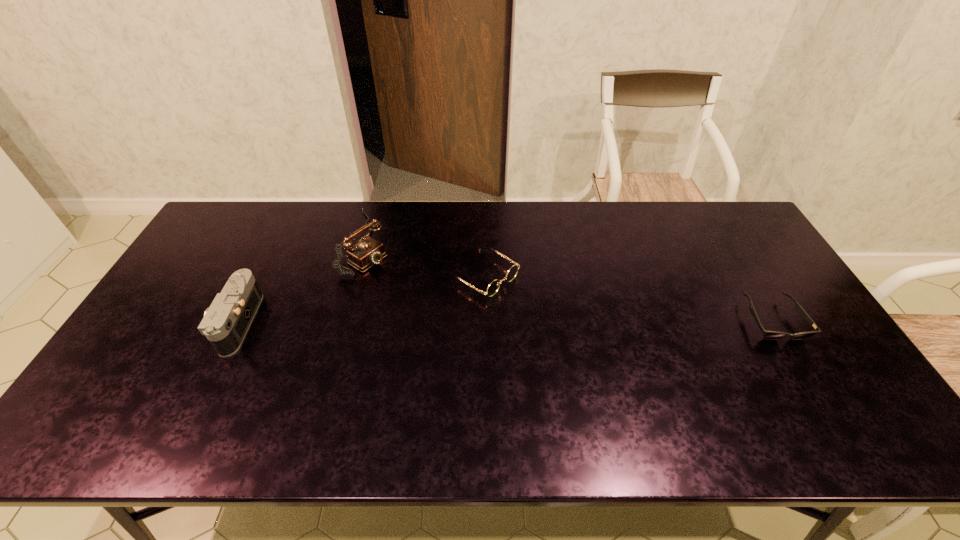
This screenshot has width=960, height=540. I want to click on free space located 0.100m on the lens of the leftmost object, so click(182, 322).

Where is `free space located 0.170m on the front-facing side of the sunglasses`? This screenshot has width=960, height=540. free space located 0.170m on the front-facing side of the sunglasses is located at coordinates (821, 402).

The width and height of the screenshot is (960, 540). What are the coordinates of `vacant point located 0.380m on the dial of the tallest object` in the screenshot? It's located at (473, 323).

Image resolution: width=960 pixels, height=540 pixels. In order to click on vacant space located on the dial of the tallest object in this screenshot , I will do `click(434, 299)`.

Locate an element on the screen. The height and width of the screenshot is (540, 960). free space located on the dial of the tallest object is located at coordinates (460, 315).

In order to click on free space located on the lenses of the third object from left to right in this screenshot , I will do `click(540, 312)`.

This screenshot has height=540, width=960. I want to click on vacant space situated 0.380m on the lenses of the third object from left to right, so click(x=623, y=367).

Image resolution: width=960 pixels, height=540 pixels. I want to click on vacant area situated on the lenses of the third object from left to right, so click(x=590, y=345).

Where is `object located in the far edge section of the desktop`? The width and height of the screenshot is (960, 540). object located in the far edge section of the desktop is located at coordinates [x=367, y=252].

This screenshot has width=960, height=540. In order to click on object present at the right edge in this screenshot , I will do `click(769, 335)`.